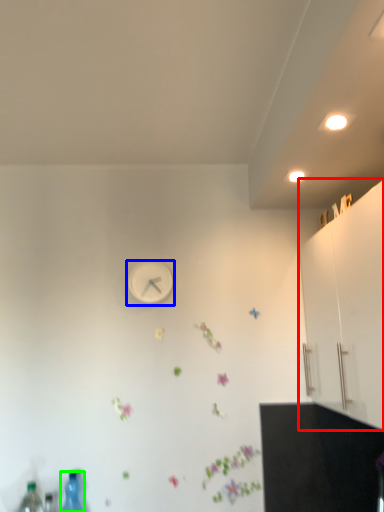
Question: Which is nearer to the dresser (highlighted by a red box)? wall clock (highlighted by a blue box) or bottle (highlighted by a green box).

Choices:
 (A) wall clock
 (B) bottle

Answer: (A)